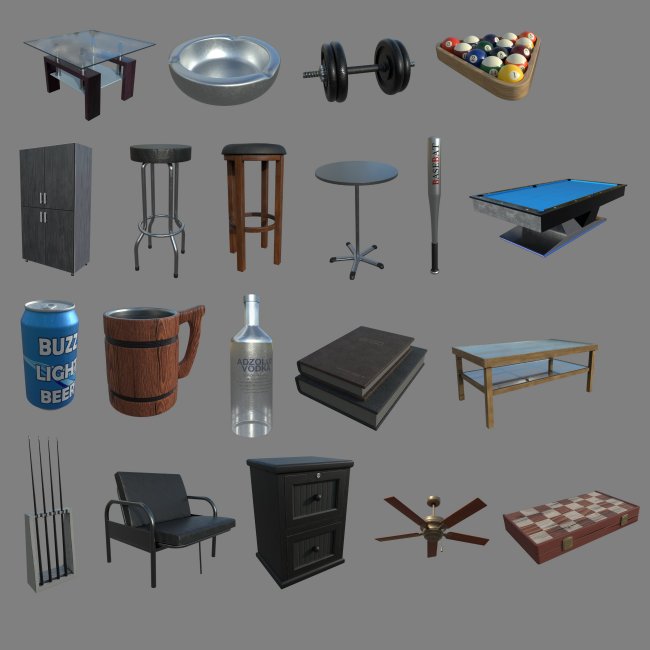
You are a GUI agent. You are given a task and a screenshot of the screen. Output one action in this format:
    pyautogui.click(x=<x>, y=<y>)
    Task: Click on the stool legs
    This screenshot has width=650, height=650.
    Given the screenshot: What is the action you would take?
    [166, 211], [177, 203], [155, 194], [143, 201]